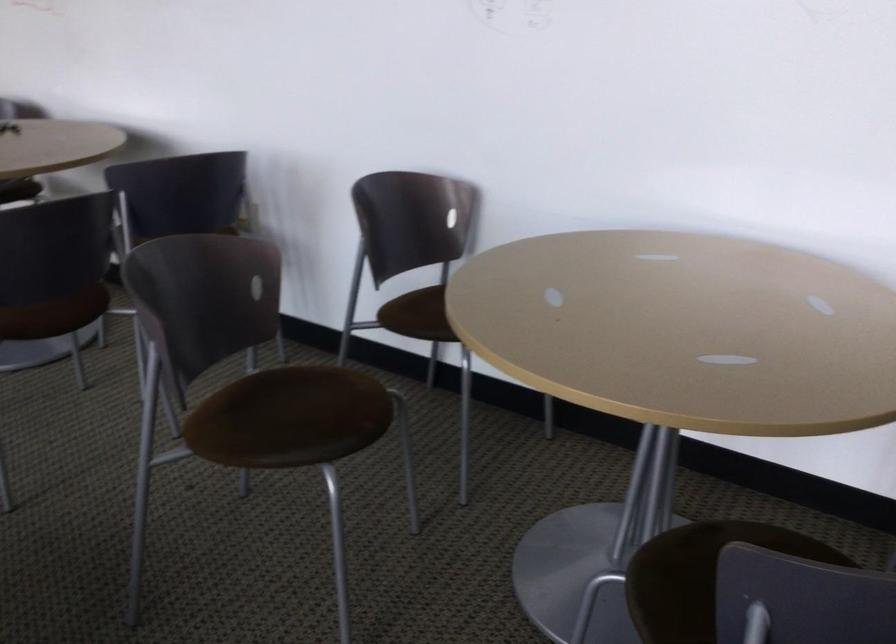
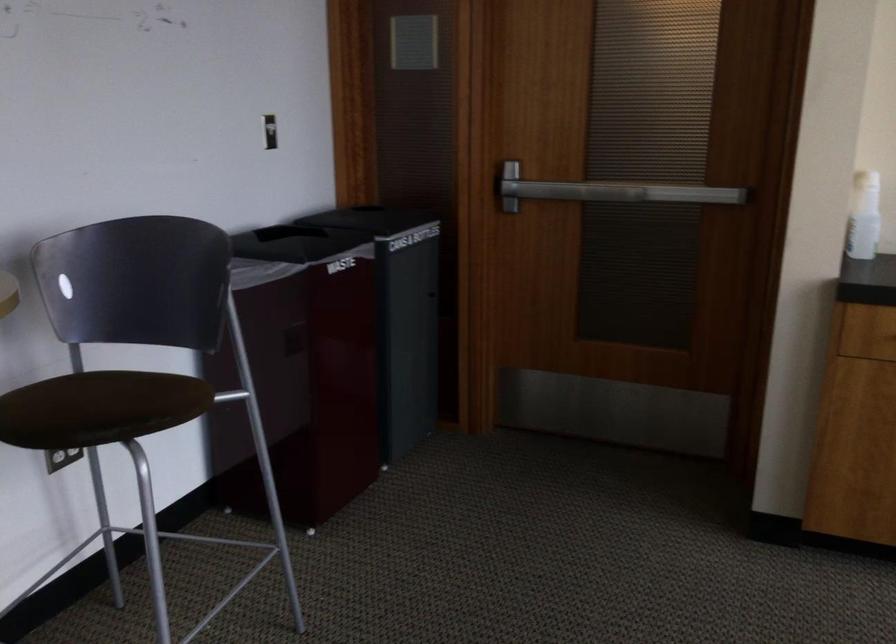
First-person continuous shooting, in which direction is the camera rotating?

The camera's rotation is toward right-down.